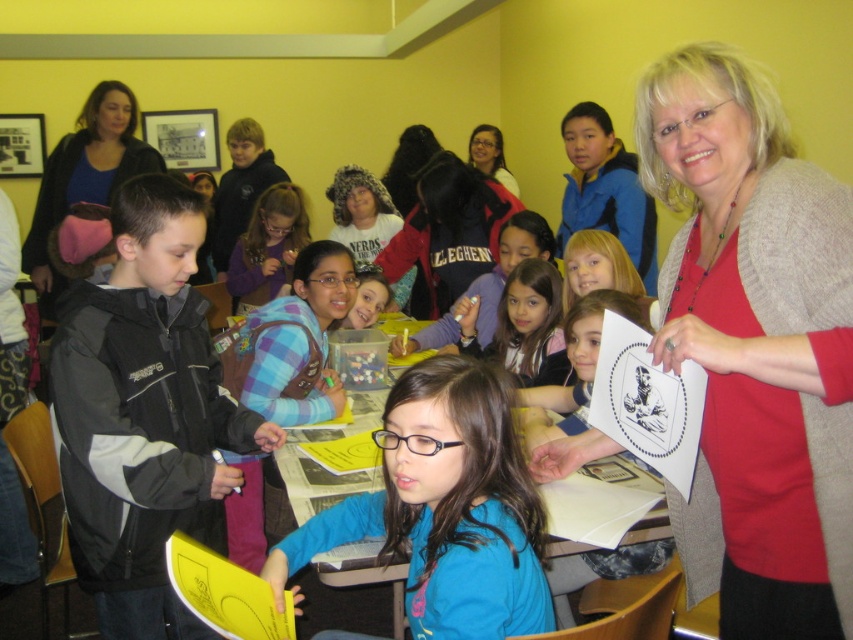
You are a teacher in the classroom and want to hand out a new craft kit to the student wearing the red sweater at upper right and the student wearing the black jacket at left. If the craft kit box is 15 inches wide, can you place it between them without it overlapping either student?

The distance between the red sweater at upper right and the black jacket at left is 32.05 inches. Since the craft kit box is 15 inches wide, which is less than the distance between them, you can place it between them without overlapping either student.

You are a teacher in the classroom and need to decide which clothing item to use for a demonstration. The blue matte shirt at center and the blue jersey at upper left are both available. Which one has a wider width?

The blue jersey at upper left has a greater width than the blue matte shirt at center, so it is wider.

You are a teacher in the classroom and need to decide which clothing item is closer to the front of the room between the blue matte shirt at center and the blue jersey at upper left. Based on their positions, which one would you say is closer?

The blue matte shirt at center is shorter than the blue jersey at upper left, so the blue matte shirt at center is closer to the front of the room.